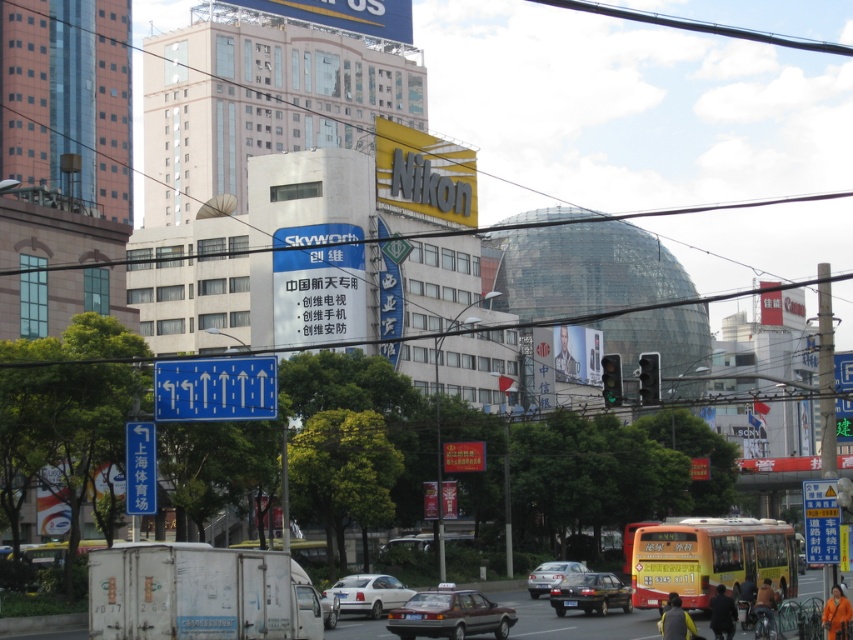
You are a delivery person who needs to move a 6 meter long ladder between the shiny black sedan at center and the white matte sedan at center. Based on the scene described, will the ladder fit through the space between them?

The shiny black sedan at center and the white matte sedan at center are 6.13 meters apart, so the 6 meter long ladder will fit through the space between them since the distance is slightly larger than the ladder.

You are a pedestrian standing on the sidewalk and want to cross the street to reach the Nikon advertisement sign. There are two cars blocking your path, a matte black car at center and a white matte sedan at center. Which car is closer to the sidewalk?

The matte black car at center is closer to the sidewalk because it is located below the white matte sedan at center, meaning it is positioned lower in the image and thus closer to the viewer.

You are a delivery person trying to park your motorcycle between the matte black car at center and the white matte sedan at center. The motorcycle requires 1.2 meters of space to fit. Can you park your motorcycle there?

The matte black car at center is wider than the white matte sedan at center, so the space between them may be sufficient for the motorcycle requiring 1.2 meters. However, without knowing the exact distance between them, it is uncertain. The description only provides information about their widths, not the distance between them.